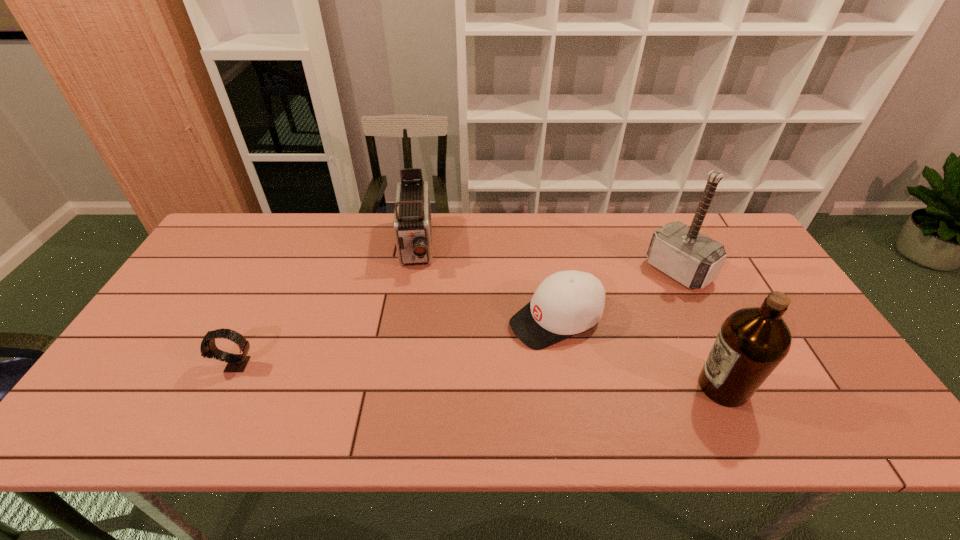
You are a GUI agent. You are given a task and a screenshot of the screen. Output one action in this format:
    pyautogui.click(x=<x>, y=<y>)
    Task: Click on the leftmost object
    This screenshot has width=960, height=540.
    Given the screenshot: What is the action you would take?
    (235, 362)

The image size is (960, 540). What are the coordinates of `olive oil` in the screenshot? It's located at (753, 341).

I want to click on the second object from left to right, so click(x=412, y=224).

This screenshot has width=960, height=540. Find the location of `camcorder`. camcorder is located at coordinates (412, 224).

This screenshot has width=960, height=540. I want to click on hammer, so click(x=683, y=253).

Locate an element on the screen. baseball cap is located at coordinates (566, 303).

This screenshot has width=960, height=540. I want to click on free space located 0.190m on the face of the leftmost object, so click(x=140, y=365).

Find the location of a particular element. free space located on the face of the leftmost object is located at coordinates (184, 365).

Locate an element on the screen. The image size is (960, 540). blank area located on the face of the leftmost object is located at coordinates (128, 365).

Image resolution: width=960 pixels, height=540 pixels. What are the coordinates of `blank space located on the label of the olive oil` in the screenshot? It's located at (650, 387).